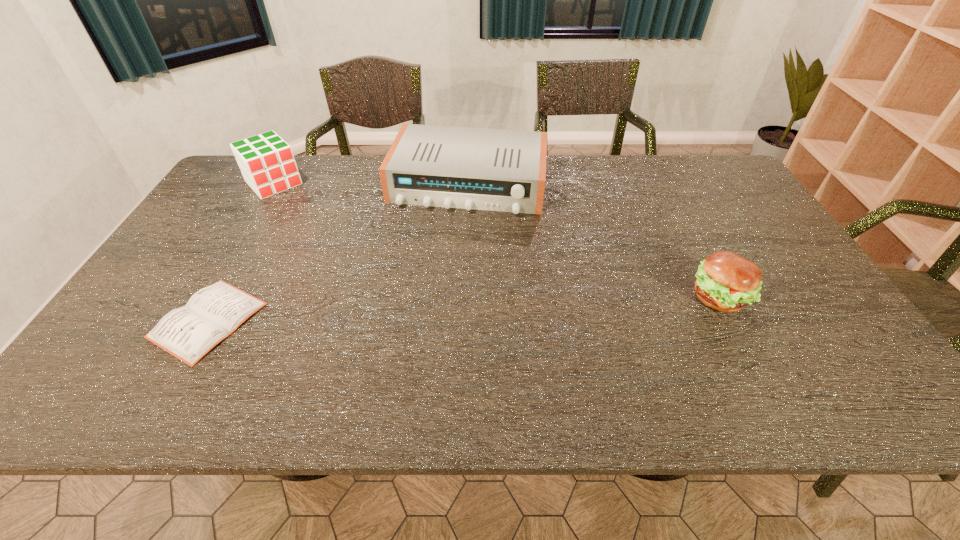
Identify the location of vacant area situated on the red face of the cube. (334, 247).

This screenshot has width=960, height=540. Find the location of `vacant space located 0.350m on the red face of the cube`. vacant space located 0.350m on the red face of the cube is located at coordinates (340, 252).

Where is `radio receiver that is at the far edge`? radio receiver that is at the far edge is located at coordinates click(501, 170).

Where is `cube present at the far edge`? Image resolution: width=960 pixels, height=540 pixels. cube present at the far edge is located at coordinates [267, 163].

Find the location of `object that is at the near edge`. object that is at the near edge is located at coordinates (213, 313).

Find the location of a particular element. Image resolution: width=960 pixels, height=540 pixels. diary at the left edge is located at coordinates (213, 313).

Locate an element on the screen. cube that is positioned at the left edge is located at coordinates (267, 163).

Locate an element on the screen. object that is at the far left corner is located at coordinates 267,163.

Locate an element on the screen. The height and width of the screenshot is (540, 960). object that is at the near left corner is located at coordinates (213, 313).

Locate an element on the screen. The height and width of the screenshot is (540, 960). free space at the far edge is located at coordinates (549, 175).